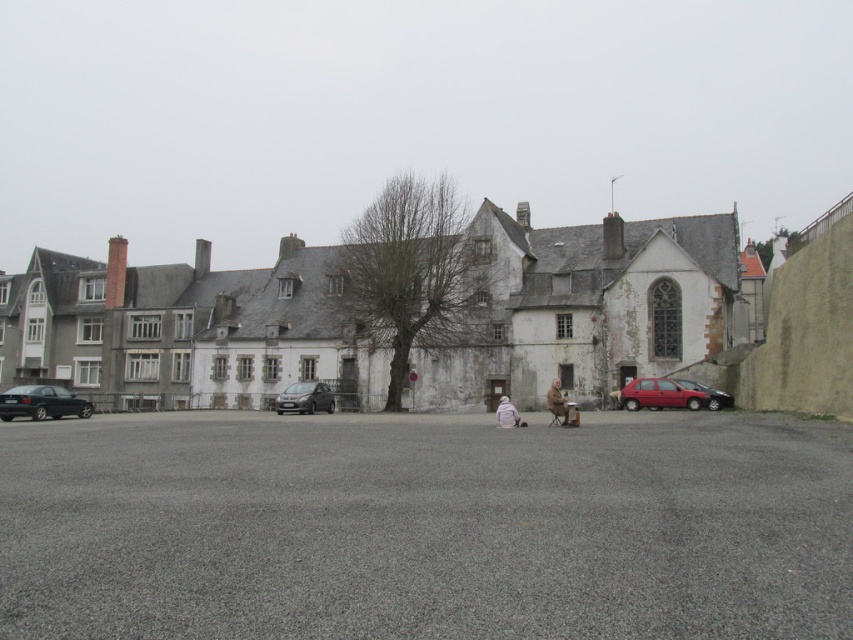
Between point (654, 380) and point (730, 403), which one is positioned behind?

The point (654, 380) is behind.

Is matte red hatchback at right above shiny black sedan at right?

Correct, matte red hatchback at right is located above shiny black sedan at right.

Image resolution: width=853 pixels, height=640 pixels. Describe the element at coordinates (659, 394) in the screenshot. I see `matte red hatchback at right` at that location.

Identify the location of matte red hatchback at right. The width and height of the screenshot is (853, 640). (659, 394).

In the scene shown: Who is positioned more to the left, shiny black sedan at left or white woolen coat at center?

From the viewer's perspective, shiny black sedan at left appears more on the left side.

Between point (16, 410) and point (566, 396), which one is positioned behind?

Point (566, 396)

Which is behind, point (30, 417) or point (561, 401)?

The point (30, 417) is more distant.

Locate an element on the screen. This screenshot has height=640, width=853. shiny black sedan at left is located at coordinates (42, 403).

Consider the image. Which is more to the right, matte red hatchback at right or white woolen sweater at center?

matte red hatchback at right is more to the right.

This screenshot has width=853, height=640. I want to click on matte red hatchback at right, so click(x=659, y=394).

Is point (689, 396) more distant than point (512, 406)?

Yes, it is.

I want to click on matte red hatchback at right, so [x=659, y=394].